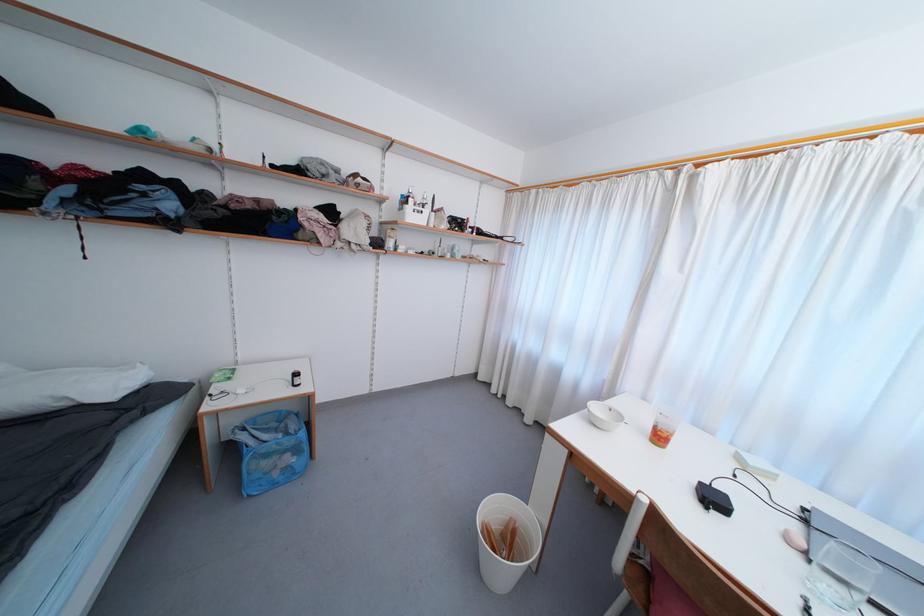
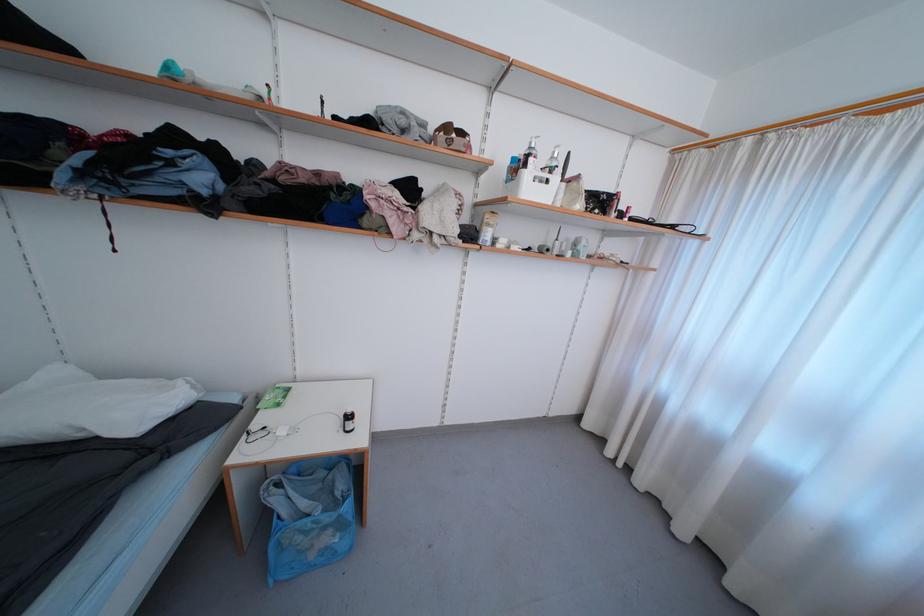
The point at [247,431] is marked in the first image. Where is the corresponding point in the second image?

(284, 488)